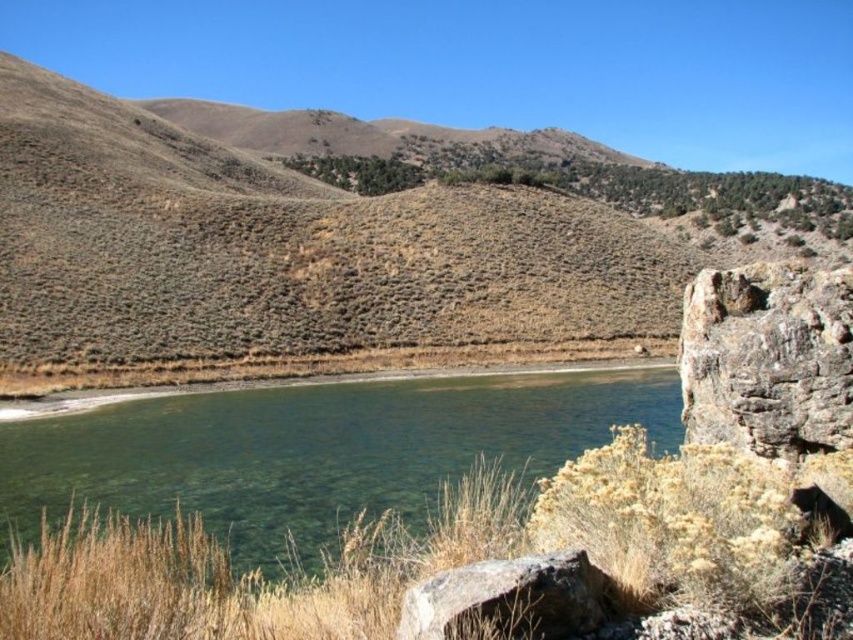
Question: Can you confirm if clear water at center is positioned to the left of rocky at lower right?

Choices:
 (A) no
 (B) yes

Answer: (B)

Question: Does brown/dry grassy hillside at center have a lesser width compared to clear water at center?

Choices:
 (A) no
 (B) yes

Answer: (A)

Question: Observing the image, what is the correct spatial positioning of clear water at center in reference to rocky at lower right?

Choices:
 (A) above
 (B) below

Answer: (B)

Question: Among these objects, which one is farthest from the camera?

Choices:
 (A) rocky at lower right
 (B) brown/dry grassy hillside at center

Answer: (B)

Question: Which point is closer to the camera?

Choices:
 (A) clear water at center
 (B) rocky at lower right

Answer: (B)

Question: Which object is positioned farthest from the brown/dry grassy hillside at center?

Choices:
 (A) rocky at lower right
 (B) clear water at center

Answer: (A)